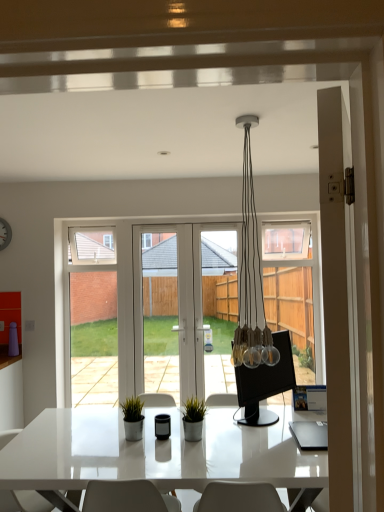
I want to click on white glossy screen door at center, positioned as the 3th screen door in left-to-right order, so click(x=213, y=298).

Where is `white glossy desk at center`? This screenshot has height=512, width=384. white glossy desk at center is located at coordinates 156,452.

How much space does clear glass door at center, the second screen door in the right-to-left sequence, occupy vertically?

It is 1.70 meters.

You are a GUI agent. You are given a task and a screenshot of the screen. Output one action in this format:
    pyautogui.click(x=<x>, y=<y>)
    Task: Click on the green matte plant at center
    
    Given the screenshot: What is the action you would take?
    pyautogui.click(x=193, y=419)

In order to face green matte plant at center, should I rotate leftwards or rightwards?

A 0.019 degree turn to the left will do.

Image resolution: width=384 pixels, height=512 pixels. What do you see at coordinates (337, 294) in the screenshot?
I see `white matte door at right` at bounding box center [337, 294].

The height and width of the screenshot is (512, 384). Identify the location of white glossy chair at lower left. (23, 501).

The height and width of the screenshot is (512, 384). Find the location of `black glossy monitor at center`. black glossy monitor at center is located at coordinates (265, 383).

Are white matte door at right and white glass screen door at left, which appears as the third screen door when viewed from the right, making contact?

No, white matte door at right is not beside white glass screen door at left, which appears as the third screen door when viewed from the right.

Based on the photo, is white matte door at right aimed at white glass screen door at left, which appears as the third screen door when viewed from the right?

No, white matte door at right is not aimed at white glass screen door at left, which appears as the third screen door when viewed from the right.

Considering the relative sizes of white matte door at right and white glass screen door at left, which appears as the third screen door when viewed from the right, in the image provided, is white matte door at right thinner than white glass screen door at left, which appears as the third screen door when viewed from the right,?

Yes, white matte door at right is thinner than white glass screen door at left, which appears as the third screen door when viewed from the right.

From a real-world perspective, is white matte door at right located higher than white glass screen door at left, the first screen door viewed from the left?

Yes, from a real-world perspective, white matte door at right is on top of white glass screen door at left, the first screen door viewed from the left.

Between white glossy screen door at center, positioned as the 3th screen door in left-to-right order, and green matte plant at center, which one has smaller size?

green matte plant at center is smaller.

Which is closer, (229, 269) or (185, 435)?

Clearly, point (229, 269) is more distant from the camera than point (185, 435).

Considering the sizes of objects white glossy screen door at center, the 1th screen door in the right-to-left sequence, and green matte plant at center in the image provided, who is wider, white glossy screen door at center, the 1th screen door in the right-to-left sequence, or green matte plant at center?

Wider between the two is green matte plant at center.

Considering the sizes of objects clear glass door at center, the second screen door in the right-to-left sequence, and white matte clock at upper left in the image provided, who is smaller, clear glass door at center, the second screen door in the right-to-left sequence, or white matte clock at upper left?

With smaller size is white matte clock at upper left.

Is clear glass door at center, marked as the 2th screen door in a left-to-right arrangement, behind white matte clock at upper left?

Yes.

Could you measure the distance between clear glass door at center, marked as the 2th screen door in a left-to-right arrangement, and white matte clock at upper left?

The distance of clear glass door at center, marked as the 2th screen door in a left-to-right arrangement, from white matte clock at upper left is 1.42 meters.

How different are the orientations of clear glass door at center, marked as the 2th screen door in a left-to-right arrangement, and white matte clock at upper left in degrees?

clear glass door at center, marked as the 2th screen door in a left-to-right arrangement, and white matte clock at upper left are facing 0.00218 degrees away from each other.

Which is in front, green matte plant at center or white matte door at right?

white matte door at right is closer to the camera.

From a real-world perspective, which is physically above, green matte plant at center or white matte door at right?

white matte door at right is physically above.

Considering the sizes of green matte plant at center and white matte door at right in the image, is green matte plant at center taller or shorter than white matte door at right?

In the image, green matte plant at center appears to be shorter than white matte door at right.

Is white matte door at right at the back of green matte plant at center?

That's not correct — green matte plant at center is not looking away from white matte door at right.

Considering the positions of point (327, 120) and point (316, 484), is point (327, 120) closer or farther from the camera than point (316, 484)?

Point (327, 120) is closer to the camera than point (316, 484).

Are white matte door at right and white glossy desk at center far apart?

Yes, white matte door at right is far from white glossy desk at center.

Is white matte door at right to the right of white glossy desk at center from the viewer's perspective?

Correct, you'll find white matte door at right to the right of white glossy desk at center.

This screenshot has height=512, width=384. Identify the location of desk in front of the black glossy monitor at center. (156, 452).

Considering the sizes of objects black glossy monitor at center and white glossy desk at center in the image provided, who is bigger, black glossy monitor at center or white glossy desk at center?

white glossy desk at center.

From a real-world perspective, is black glossy monitor at center physically below white glossy desk at center?

No, from a real-world perspective, black glossy monitor at center is not beneath white glossy desk at center.

Is white glossy desk at center at the back of green matte plant at center?

No, white glossy desk at center is not at the back of green matte plant at center.

Is green matte plant at center further to camera compared to white glossy desk at center?

Yes, it is.

Is green matte plant at center thinner than white glossy desk at center?

Yes, green matte plant at center is thinner than white glossy desk at center.

From the image's perspective, between green matte plant at center and white glossy desk at center, who is located below?

white glossy desk at center, from the image's perspective.

You are a GUI agent. You are given a task and a screenshot of the screen. Output one action in this format:
    pyautogui.click(x=<x>, y=<y>)
    Task: Click on the 3rd screen door behind the white matte door at right, starting your count from the anchor
    
    Given the screenshot: What is the action you would take?
    pyautogui.click(x=92, y=315)

I want to click on houseplant in front of the white glossy screen door at center, the 1th screen door in the right-to-left sequence, so click(x=193, y=419).

Looking at the image, which one is located closer to green matte plant at center, white matte clock at upper left or clear glass door at center, marked as the 2th screen door in a left-to-right arrangement?

clear glass door at center, marked as the 2th screen door in a left-to-right arrangement, is closer to green matte plant at center.

From the image, which object appears to be farther from white glossy screen door at center, positioned as the 3th screen door in left-to-right order, white matte door at right or green matte plant at center?

white matte door at right lies further to white glossy screen door at center, positioned as the 3th screen door in left-to-right order, than the other object.

Considering their positions, is white glossy screen door at center, the 1th screen door in the right-to-left sequence, positioned closer to white matte clock at upper left than white matte door at right?

Among the two, white glossy screen door at center, the 1th screen door in the right-to-left sequence, is located nearer to white matte clock at upper left.

Considering their positions, is white glass screen door at left, which appears as the third screen door when viewed from the right, positioned further to green matte plant at center than white matte clock at upper left?

Among the two, white matte clock at upper left is located further to green matte plant at center.

From the picture: Which object lies further to the anchor point white glossy chair at lower left, white glossy screen door at center, the 1th screen door in the right-to-left sequence, or green matte plant at center?

white glossy screen door at center, the 1th screen door in the right-to-left sequence, is positioned further to the anchor white glossy chair at lower left.

Considering their positions, is black glossy monitor at center positioned further to white matte door at right than white glass screen door at left, which appears as the third screen door when viewed from the right?

white glass screen door at left, which appears as the third screen door when viewed from the right, is further to white matte door at right.

Which object lies nearer to the anchor point white glossy screen door at center, positioned as the 3th screen door in left-to-right order, white glossy chair at lower left or white glossy desk at center?

white glossy desk at center is positioned closer to the anchor white glossy screen door at center, positioned as the 3th screen door in left-to-right order.

Which object lies further to the anchor point green matte plant at center, white matte door at right or white glossy chair at lower left?

white matte door at right.

This screenshot has width=384, height=512. Identify the location of houseplant between white matte door at right and clear glass door at center, marked as the 2th screen door in a left-to-right arrangement, in the front-back direction. (193, 419).

Identify the location of screen door between white matte clock at upper left and clear glass door at center, the second screen door in the right-to-left sequence. (92, 315).

Locate an element on the screen. The width and height of the screenshot is (384, 512). clock between green matte plant at center and white glass screen door at left, the first screen door viewed from the left, along the z-axis is located at coordinates (5, 234).

Locate an element on the screen. houseplant between black glossy monitor at center and white glossy desk at center in the vertical direction is located at coordinates (193, 419).